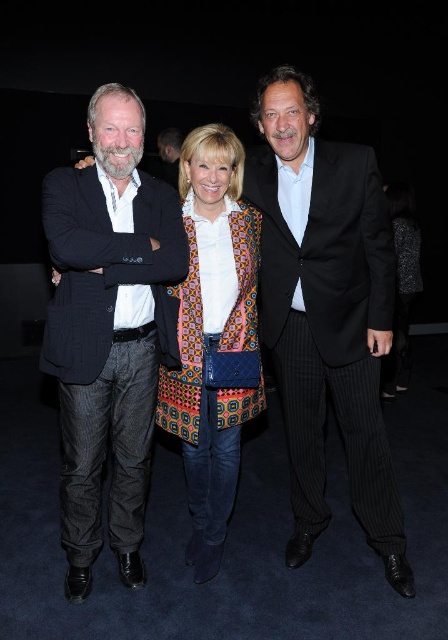
Does point (349, 472) come behind point (102, 129)?

That is True.

Find the location of a particular element. This screenshot has height=640, width=448. black pinstripe suit at center is located at coordinates (326, 310).

Is dark blue pinstripe suit at left below patterned fabric coat at center?

Incorrect, dark blue pinstripe suit at left is not positioned below patterned fabric coat at center.

From the picture: Does dark blue pinstripe suit at left have a smaller size compared to patterned fabric coat at center?

No.

What do you see at coordinates (108, 330) in the screenshot? I see `dark blue pinstripe suit at left` at bounding box center [108, 330].

The image size is (448, 640). What are the coordinates of `dark blue pinstripe suit at left` in the screenshot? It's located at (108, 330).

Which is behind, point (275, 358) or point (242, 250)?

Point (275, 358)

Is black pinstripe suit at center smaller than patterned fabric coat at center?

No, black pinstripe suit at center is not smaller than patterned fabric coat at center.

Between point (267, 132) and point (228, 346), which one is positioned behind?

Positioned behind is point (228, 346).

This screenshot has width=448, height=640. Identify the location of black pinstripe suit at center. (326, 310).